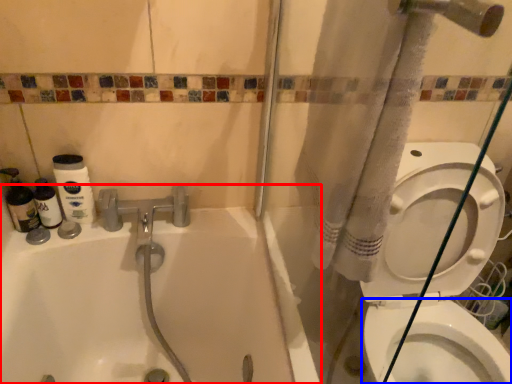
Question: Which of the following is the farthest to the observer, bathtub (highlighted by a red box) or bidet (highlighted by a blue box)?

Choices:
 (A) bathtub
 (B) bidet

Answer: (B)